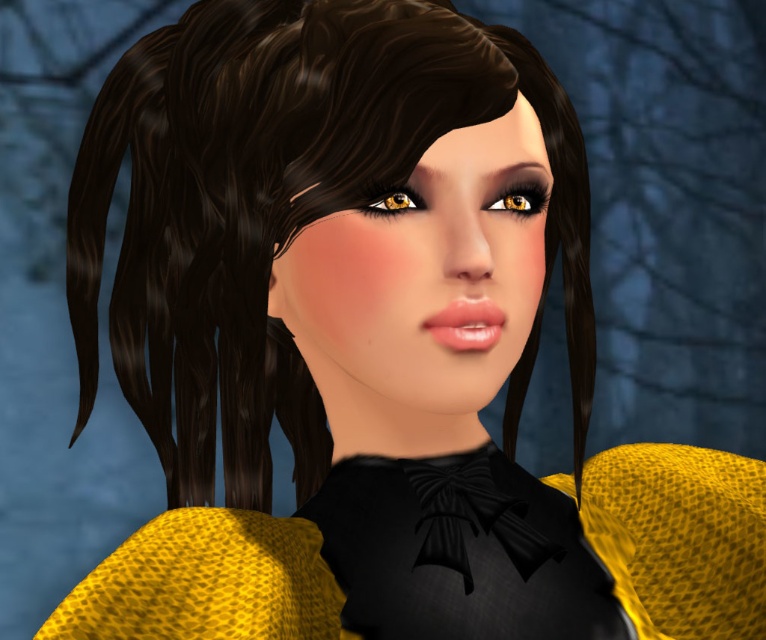
Question: Does golden matte eye at center have a smaller size compared to matte yellow eye at upper center?

Choices:
 (A) no
 (B) yes

Answer: (A)

Question: Which point is closer to the camera?

Choices:
 (A) (383, 198)
 (B) (159, 548)

Answer: (A)

Question: Based on their relative distances, which object is nearer to the matte yellow eye at upper center?

Choices:
 (A) golden matte eye at center
 (B) yellow mesh dress at center

Answer: (A)

Question: Among these objects, which one is farthest from the camera?

Choices:
 (A) golden matte eye at center
 (B) yellow mesh dress at center
 (C) matte yellow eye at upper center

Answer: (A)

Question: Is yellow mesh dress at center smaller than matte yellow eye at upper center?

Choices:
 (A) yes
 (B) no

Answer: (B)

Question: From the image, what is the correct spatial relationship of golden matte eye at center in relation to matte yellow eye at upper center?

Choices:
 (A) above
 (B) below

Answer: (A)